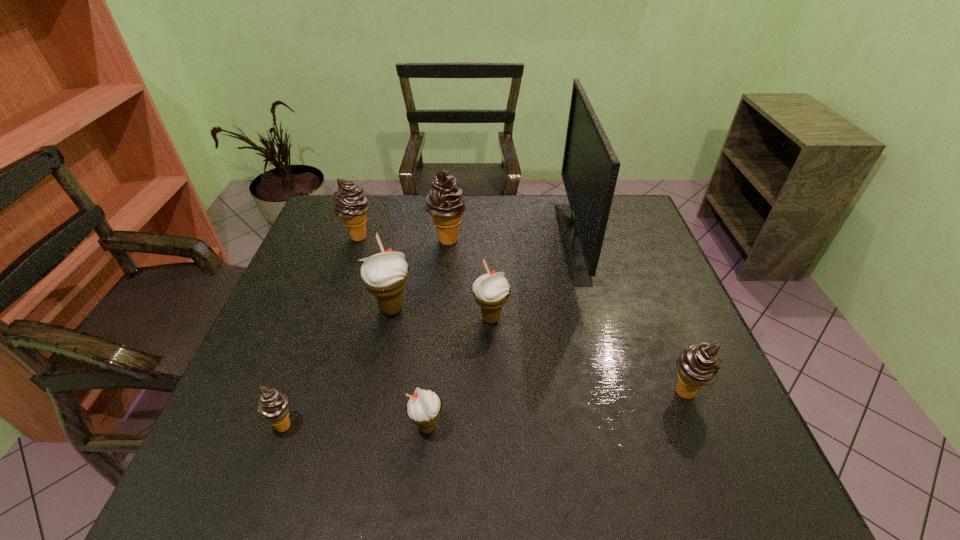
You are a GUI agent. You are given a task and a screenshot of the screen. Output one action in this format:
    pyautogui.click(x=<x>, y=<y>)
    Task: Click on the seventh object from left to right
    Image resolution: width=960 pixels, height=540 pixels.
    Given the screenshot: What is the action you would take?
    pyautogui.click(x=590, y=168)

You are a GUI agent. You are given a task and a screenshot of the screen. Output one action in this format:
    pyautogui.click(x=<x>, y=<y>)
    Task: Click on the monitor
    The height and width of the screenshot is (540, 960).
    Given the screenshot: What is the action you would take?
    pyautogui.click(x=590, y=168)

Find the location of a particular element. the third chocolate icecream from left to right is located at coordinates (445, 203).

What are the coordinates of `the tallest icecream` in the screenshot? It's located at (445, 203).

You are a GUI agent. You are given a task and a screenshot of the screen. Output one action in this format:
    pyautogui.click(x=<x>, y=<y>)
    Task: Click on the second biggest chocolate icecream
    This screenshot has width=960, height=540.
    Given the screenshot: What is the action you would take?
    pyautogui.click(x=350, y=203)

At what (x,y) coordinates should I click in order to perform the action: click on the third icecream from left to right. Please return your answer as a coordinate pair (x, y). The height and width of the screenshot is (540, 960). Looking at the image, I should click on (385, 275).

Locate an element on the screen. Image resolution: width=960 pixels, height=540 pixels. the sixth object from right to left is located at coordinates (385, 275).

I want to click on the sixth farthest object, so click(698, 365).

The width and height of the screenshot is (960, 540). Find the location of `the rightmost object`. the rightmost object is located at coordinates (698, 365).

At what (x,y) coordinates should I click in order to perform the action: click on the rightmost white icecream. Please return your answer as a coordinate pair (x, y). This screenshot has width=960, height=540. Looking at the image, I should click on (491, 291).